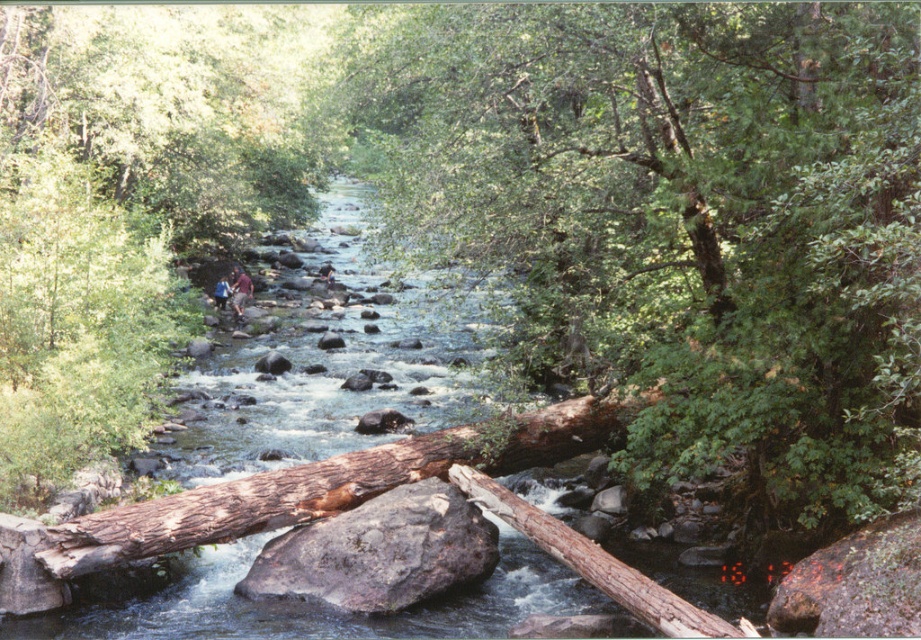
You are a hiker trying to cross the stream safely. You see a smooth brown log at center and a brown rough rock at center. Which object is closer to you as you approach the stream?

The smooth brown log at center is in front of the brown rough rock at center, so it is closer to you as you approach the stream.

You are planning to cross the stream and need to step on the smooth brown log at center and the brown rough rock at center. Which object is wider and can provide a safer stepping stone?

The smooth brown log at center might be wider than brown rough rock at center, so it can provide a safer stepping stone.

You are standing at the point with coordinates (679, 218) in the serene natural scene. What object is located exactly at that point?

The smooth brown log at center is located exactly at point (679, 218).